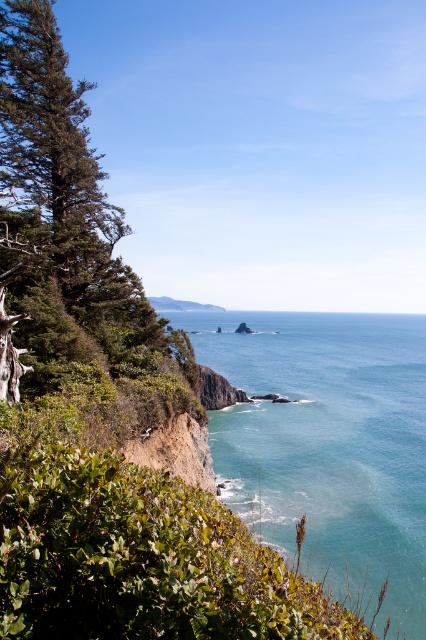
Question: Which point is closer to the camera taking this photo?

Choices:
 (A) (368, 611)
 (B) (2, 243)

Answer: (B)

Question: Which point is farther from the camera taking this photo?

Choices:
 (A) (42, 324)
 (B) (414, 486)

Answer: (B)

Question: Does clear blue water at center have a smaller size compared to green leafy tree at left?

Choices:
 (A) yes
 (B) no

Answer: (B)

Question: Does clear blue water at center have a lesser width compared to green leafy tree at left?

Choices:
 (A) yes
 (B) no

Answer: (B)

Question: Among these points, which one is nearest to the camera?

Choices:
 (A) (365, 340)
 (B) (28, 76)

Answer: (B)

Question: Can you confirm if clear blue water at center is thinner than green leafy tree at left?

Choices:
 (A) no
 (B) yes

Answer: (A)